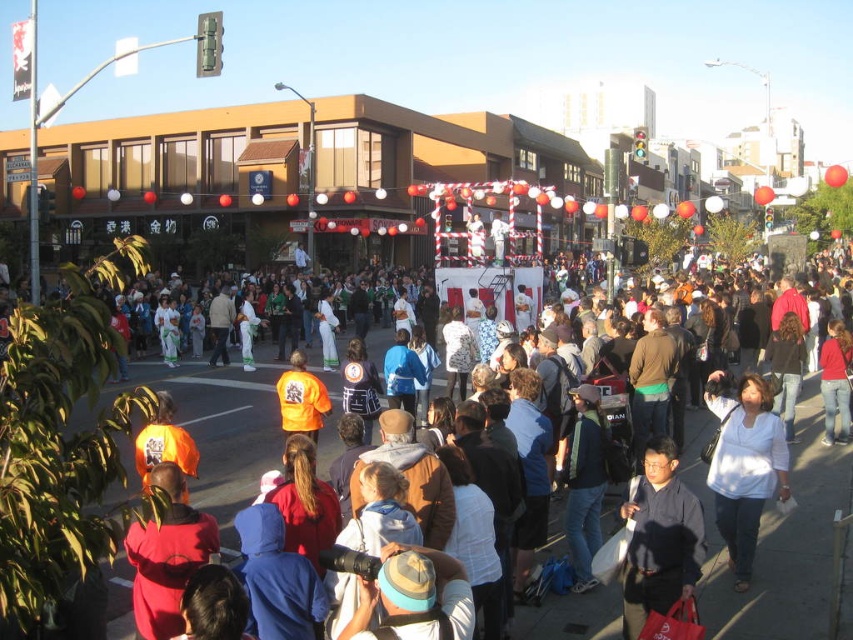
Which is more to the right, white matte shirt at center or orange reflective vest at center?

From the viewer's perspective, white matte shirt at center appears more on the right side.

Does white matte shirt at center have a larger size compared to orange reflective vest at center?

Incorrect, white matte shirt at center is not larger than orange reflective vest at center.

Does point (752, 381) lie behind point (157, 637)?

Yes, it is.

This screenshot has width=853, height=640. Identify the location of white matte shirt at center. (746, 468).

Does point (732, 605) come in front of point (737, 497)?

Yes, point (732, 605) is in front of point (737, 497).

Which is more to the right, white paper float at center or white matte shirt at center?

From the viewer's perspective, white matte shirt at center appears more on the right side.

The width and height of the screenshot is (853, 640). What are the coordinates of `white paper float at center` in the screenshot? It's located at pos(776,538).

Can you confirm if dark gray shirt at center is thinner than orange reflective vest at center?

Correct, dark gray shirt at center's width is less than orange reflective vest at center's.

Between dark gray shirt at center and orange reflective vest at center, which one is positioned higher?

Positioned higher is dark gray shirt at center.

What do you see at coordinates (659, 538) in the screenshot? I see `dark gray shirt at center` at bounding box center [659, 538].

Find the location of a particular element. dark gray shirt at center is located at coordinates (659, 538).